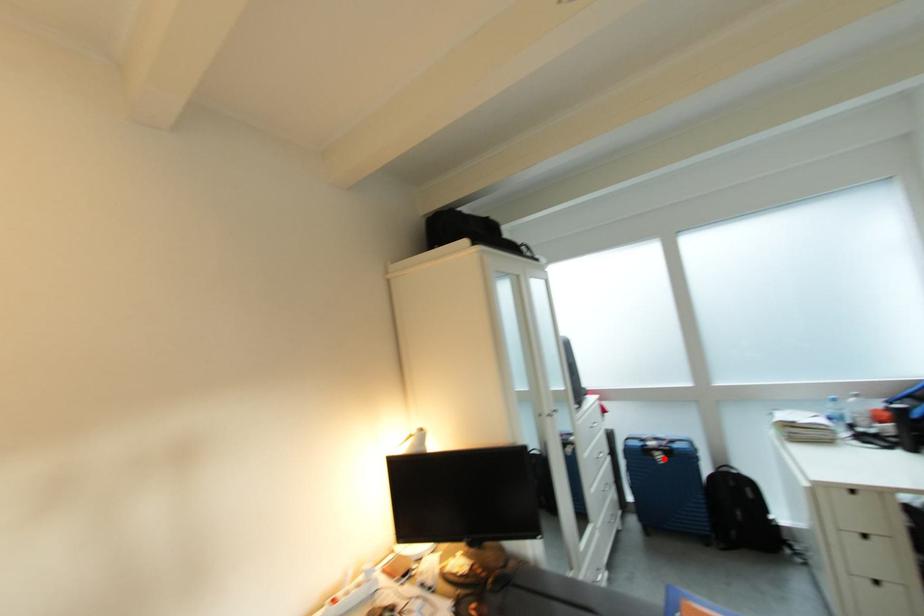
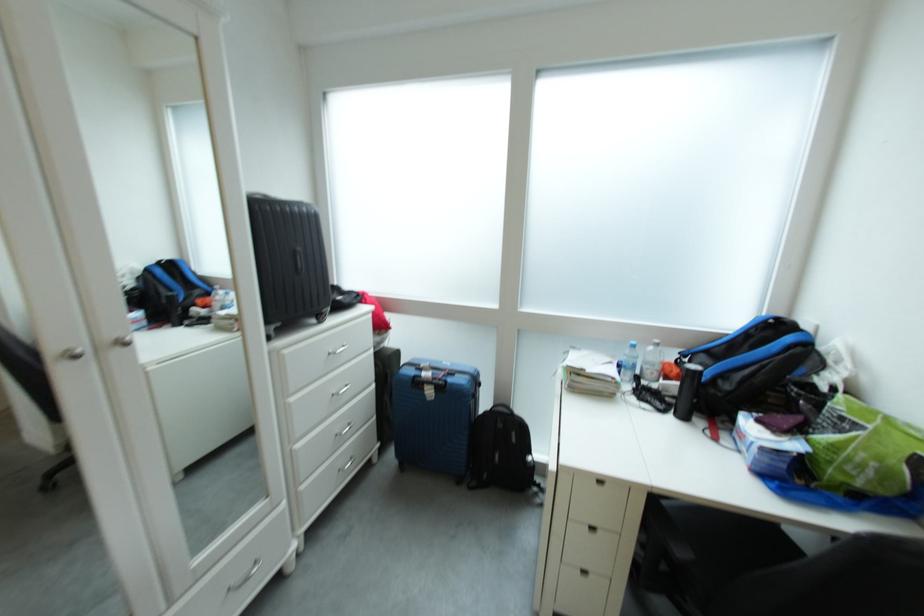
The point at the highlighted location is marked in the first image. Where is the corresponding point in the second image?

(434, 392)